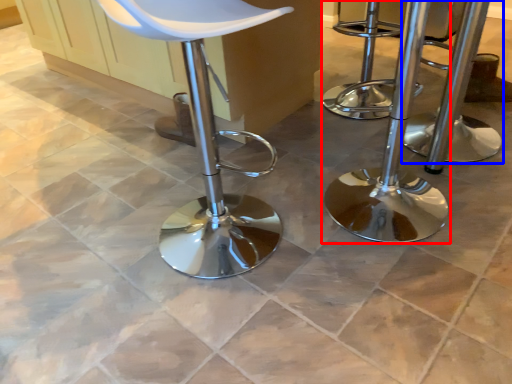
Question: Which object appears farthest to the camera in this image, stool (highlighted by a red box) or stool (highlighted by a blue box)?

Choices:
 (A) stool
 (B) stool

Answer: (B)